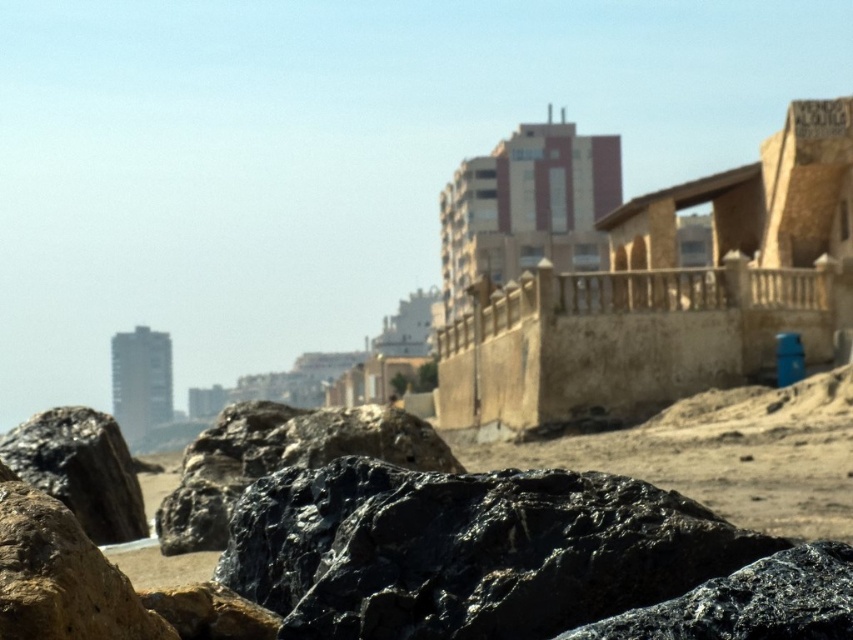
Does shiny black rock at lower left have a smaller size compared to black rough rock at lower left?

Indeed, shiny black rock at lower left has a smaller size compared to black rough rock at lower left.

Which is above, shiny black rock at lower left or black rough rock at lower left?

black rough rock at lower left is above.

Is point (502, 605) positioned behind point (138, 522)?

No.

Where is `shiny black rock at lower left`? shiny black rock at lower left is located at coordinates (498, 548).